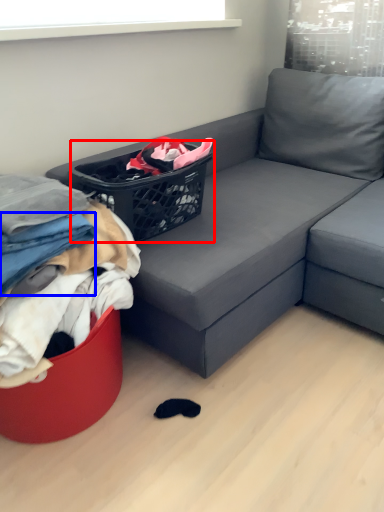
Question: Which object appears farthest to the camera in this image, basket (highlighted by a red box) or clothing (highlighted by a blue box)?

Choices:
 (A) basket
 (B) clothing

Answer: (A)